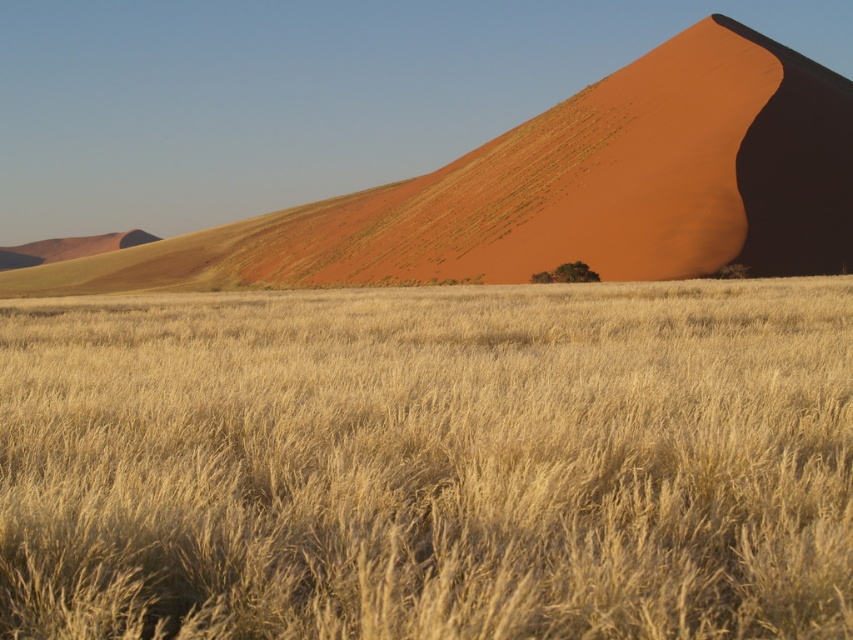
You are a desert explorer who needs to cross from one side of the desert to the other. You see the golden grass at center and the smooth sand dune at upper right. Which of these two landmarks is smaller in size and would be easier to navigate around?

The golden grass at center is smaller in size compared to the smooth sand dune at upper right, so it would be easier to navigate around.

You are a hiker trying to determine the highest point in the desert scene. Which object between the golden grass at center and the smooth sand dune at upper right is taller?

The smooth sand dune at upper right is taller than the golden grass at center.

Looking at this image, you are standing in the desert and see two points marked on the ground. The first point is at coordinates point [827,353] and the second is at point [602,113]. Which point is closer to you?

Point [827,353] is in front of point [602,113], so it is closer to you.